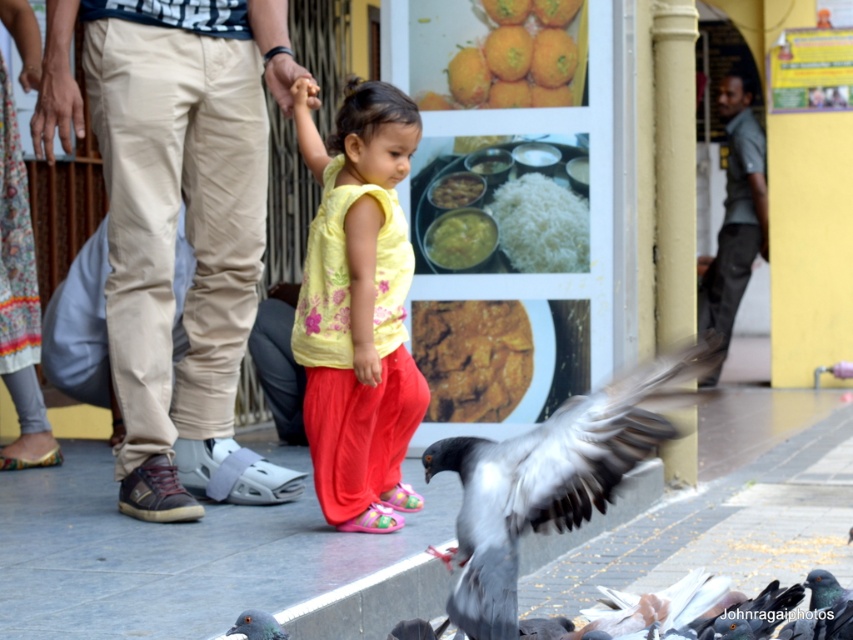
Which is more to the right, matte yellow blouse at center or floral-patterned fabric at left?

From the viewer's perspective, matte yellow blouse at center appears more on the right side.

Which is in front, point (357, 500) or point (9, 314)?

Point (357, 500)

Where is `matte yellow blouse at center`? matte yellow blouse at center is located at coordinates (358, 308).

The height and width of the screenshot is (640, 853). What do you see at coordinates (550, 477) in the screenshot? I see `gray feathered bird at lower right` at bounding box center [550, 477].

Does gray feathered bird at lower right appear on the right side of yellowish matte rice at center?

Indeed, gray feathered bird at lower right is positioned on the right side of yellowish matte rice at center.

Describe the element at coordinates (550, 477) in the screenshot. I see `gray feathered bird at lower right` at that location.

The height and width of the screenshot is (640, 853). I want to click on gray feathered bird at lower right, so click(550, 477).

Between point (373, 236) and point (527, 237), which one is positioned behind?

Positioned behind is point (527, 237).

Which is more to the right, matte yellow blouse at center or white matte rice at center?

white matte rice at center is more to the right.

Is point (352, 282) positioned after point (529, 180)?

No, (352, 282) is in front of (529, 180).

Locate an element on the screen. This screenshot has height=640, width=853. matte yellow blouse at center is located at coordinates (358, 308).